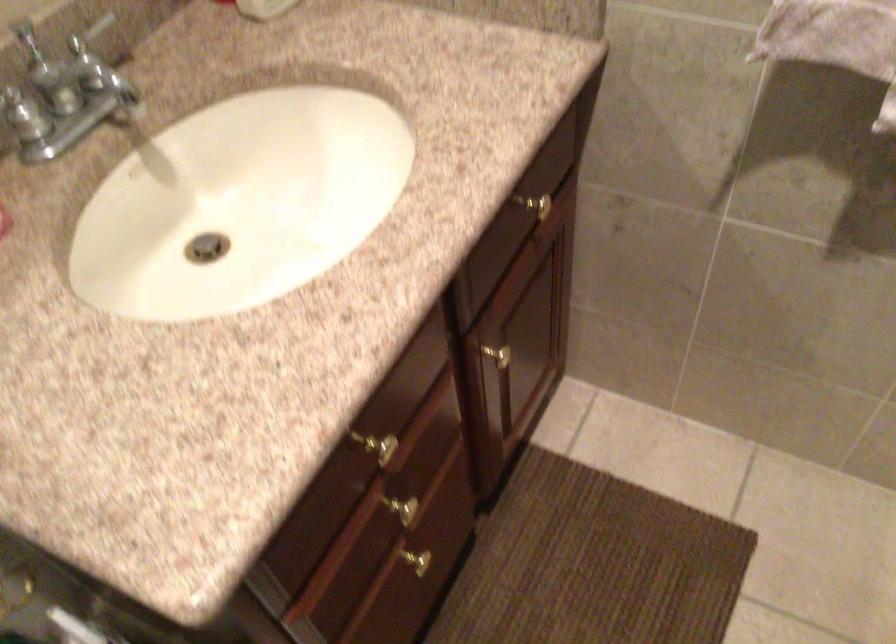
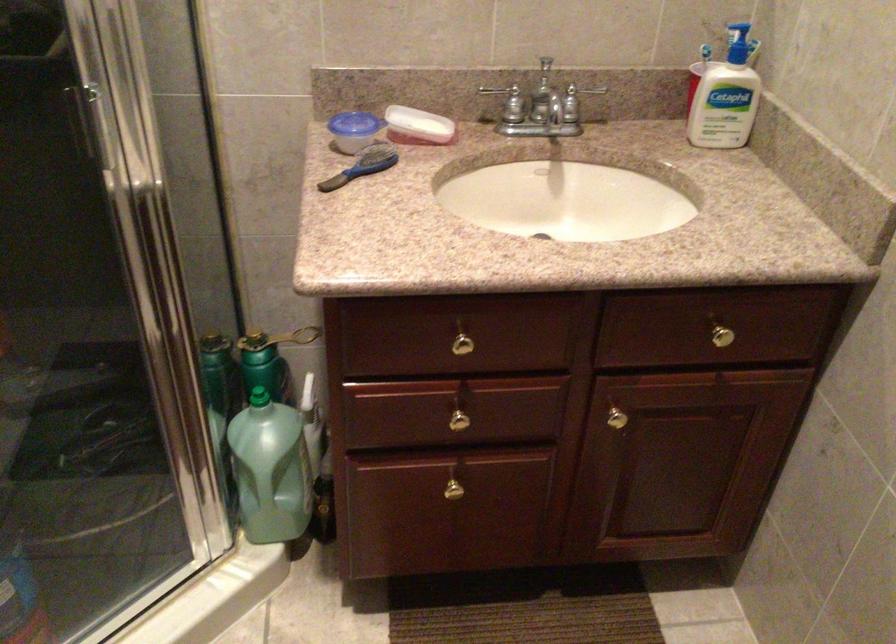
Where in the second image is the point corresponding to pixel 394 507 from the first image?

(459, 415)